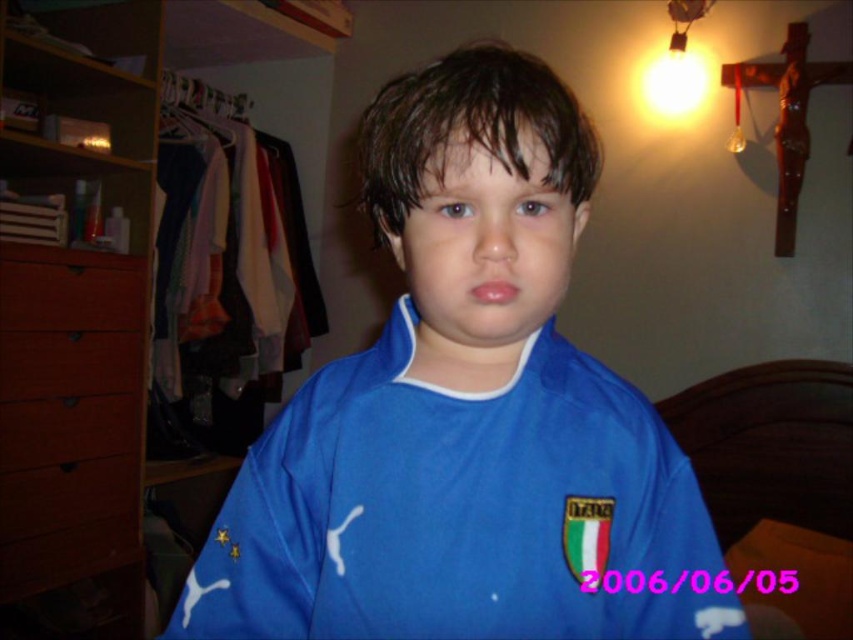
Question: Can you confirm if blue fabric shirt at center is thinner than brown wood drawer at left?

Choices:
 (A) yes
 (B) no

Answer: (B)

Question: Among these objects, which one is farthest from the camera?

Choices:
 (A) blue fabric shirt at center
 (B) brown wood dresser at left
 (C) brown wood drawer at left

Answer: (B)

Question: Is blue fabric shirt at center below brown wood dresser at left?

Choices:
 (A) no
 (B) yes

Answer: (B)

Question: Does blue fabric shirt at center lie in front of brown wood drawer at left?

Choices:
 (A) yes
 (B) no

Answer: (A)

Question: Which object appears closest to the camera in this image?

Choices:
 (A) brown wood drawer at left
 (B) blue fabric shirt at center
 (C) brown wood dresser at left

Answer: (B)

Question: Based on their relative distances, which object is nearer to the brown wood drawer at left?

Choices:
 (A) blue fabric shirt at center
 (B) brown wood dresser at left

Answer: (B)